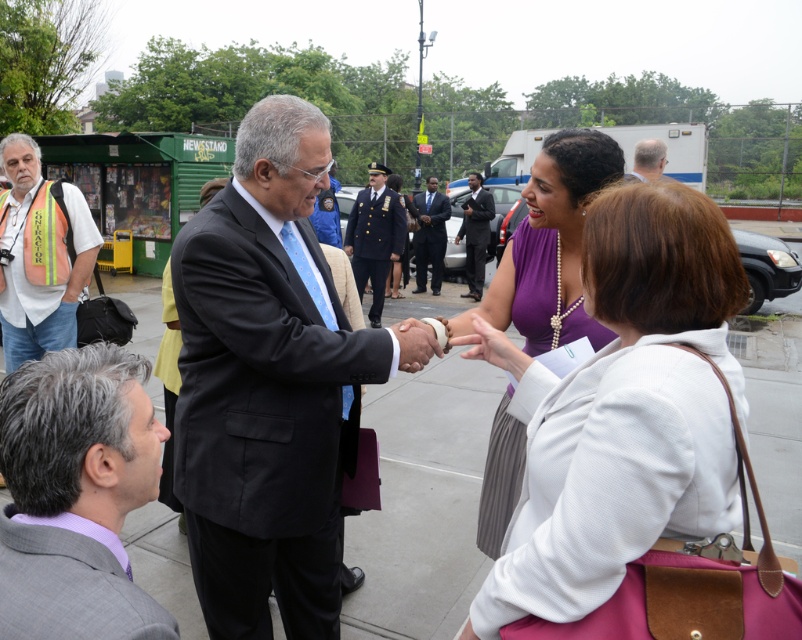
Question: Which point is farther to the camera?

Choices:
 (A) (346, 250)
 (B) (124, 625)
 (C) (643, 467)
 (D) (661, 168)

Answer: (A)

Question: Does orange reflective vest at left appear over gray hair at center?

Choices:
 (A) no
 (B) yes

Answer: (A)

Question: Does gray wool suit at lower left have a larger size compared to gray hair at center?

Choices:
 (A) yes
 (B) no

Answer: (B)

Question: In this image, where is matte purple dress at center located relative to dark blue suit at center?

Choices:
 (A) left
 (B) right

Answer: (A)

Question: Which object is the closest to the gray hair at center?

Choices:
 (A) gray suit at center
 (B) shiny black suit at center

Answer: (A)

Question: Which object appears farthest from the camera in this image?

Choices:
 (A) gray wool suit at lower left
 (B) gray suit at center
 (C) purple satin dress at center
 (D) dark blue suit at center

Answer: (D)